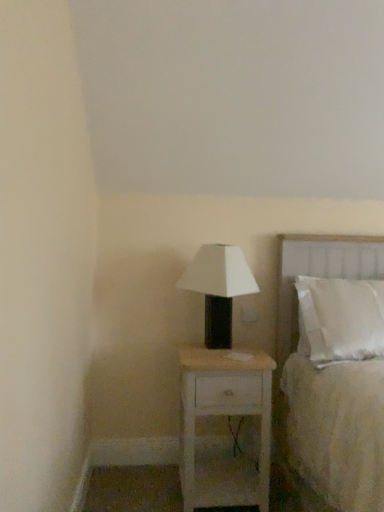
Question: Does white wood nightstand at center come behind white fabric bed at right?

Choices:
 (A) no
 (B) yes

Answer: (B)

Question: Can white fabric bed at right be found inside white wood nightstand at center?

Choices:
 (A) yes
 (B) no

Answer: (B)

Question: Does white wood nightstand at center touch white fabric bed at right?

Choices:
 (A) no
 (B) yes

Answer: (A)

Question: Can you confirm if white wood nightstand at center is positioned to the right of white fabric bed at right?

Choices:
 (A) yes
 (B) no

Answer: (B)

Question: From the image's perspective, is white wood nightstand at center located beneath white fabric bed at right?

Choices:
 (A) no
 (B) yes

Answer: (B)

Question: From a real-world perspective, is white fabric bed at right above or below white matte table lamp at center?

Choices:
 (A) below
 (B) above

Answer: (A)

Question: Choose the correct answer: Is white fabric bed at right inside white matte table lamp at center or outside it?

Choices:
 (A) inside
 (B) outside

Answer: (B)

Question: In the image, is white fabric bed at right positioned in front of or behind white matte table lamp at center?

Choices:
 (A) front
 (B) behind

Answer: (A)

Question: In the image, is white fabric bed at right on the left side or the right side of white matte table lamp at center?

Choices:
 (A) right
 (B) left

Answer: (A)

Question: In terms of height, does white matte table lamp at center look taller or shorter compared to white fabric bed at right?

Choices:
 (A) short
 (B) tall

Answer: (A)

Question: Is white matte table lamp at center in front of or behind white fabric bed at right in the image?

Choices:
 (A) behind
 (B) front

Answer: (A)

Question: Considering the relative positions of white matte table lamp at center and white fabric bed at right in the image provided, is white matte table lamp at center to the left or to the right of white fabric bed at right?

Choices:
 (A) right
 (B) left

Answer: (B)

Question: Is white matte table lamp at center wider or thinner than white fabric bed at right?

Choices:
 (A) thin
 (B) wide

Answer: (A)

Question: In the image, is white wood nightstand at center positioned in front of or behind white matte table lamp at center?

Choices:
 (A) front
 (B) behind

Answer: (A)

Question: Considering the positions of white wood nightstand at center and white matte table lamp at center in the image, is white wood nightstand at center bigger or smaller than white matte table lamp at center?

Choices:
 (A) big
 (B) small

Answer: (A)